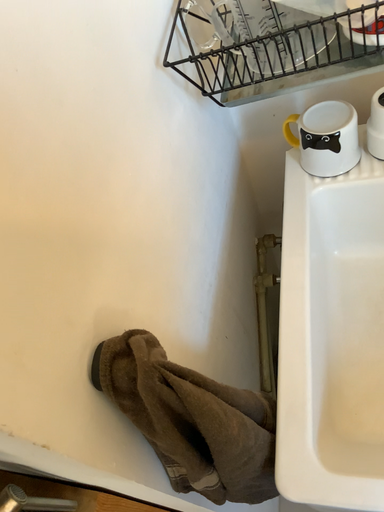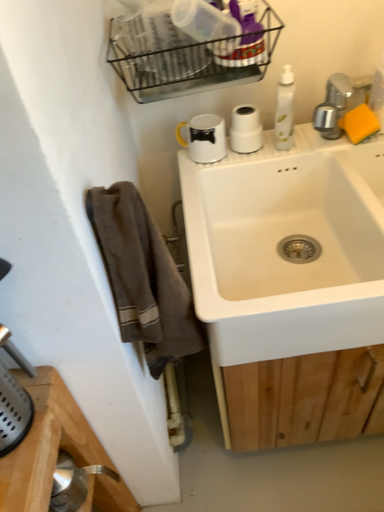
Question: Which way did the camera rotate in the video?

Choices:
 (A) rotated downward
 (B) rotated upward

Answer: (B)